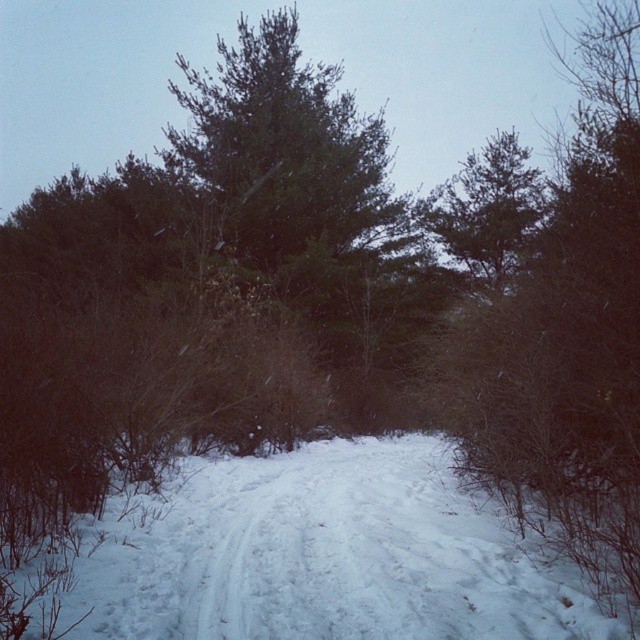
You are standing at the starting point of the snow path and want to reach the end of the path. There are two points marked on the path, point A at coordinates point A is point (499, 582) and point B at coordinates point B is point (451, 234). Which point should you head towards first to follow the path correctly?

You should head towards point A at coordinates point A is point (499, 582) first because it is in front of point B at coordinates point B is point (451, 234) along the path.